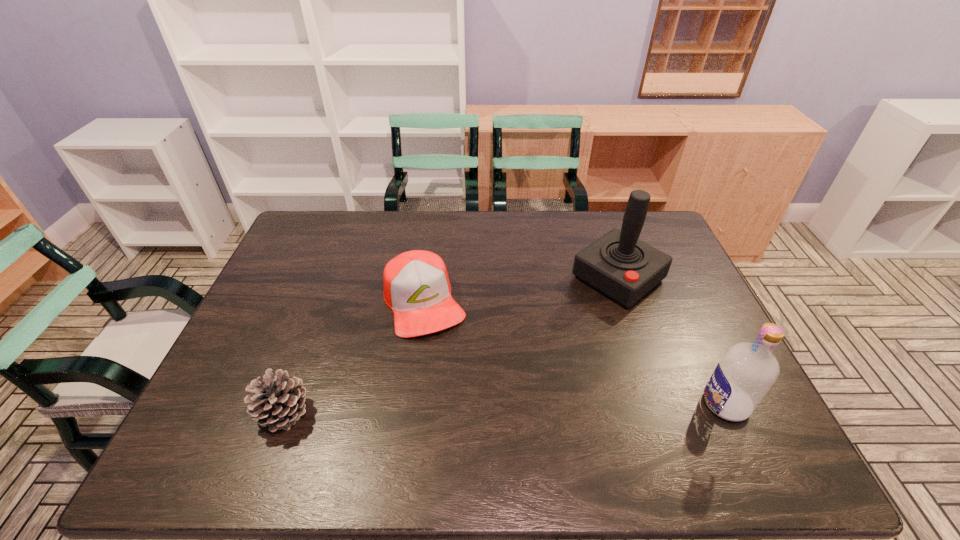
Image resolution: width=960 pixels, height=540 pixels. In order to click on vacant space located 0.060m on the front-facing side of the baseball cap in this screenshot , I will do `click(444, 354)`.

Locate an element on the screen. The height and width of the screenshot is (540, 960). free space located 0.280m on the base of the joystick is located at coordinates (524, 351).

At what (x,y) coordinates should I click in order to perform the action: click on vacant position located 0.290m on the base of the joystick. Please return your answer as a coordinate pair (x, y). This screenshot has width=960, height=540. Looking at the image, I should click on 521,353.

Identify the location of vacant space located 0.400m on the base of the joystick. This screenshot has width=960, height=540. pyautogui.click(x=492, y=376).

Locate an element on the screen. The width and height of the screenshot is (960, 540). object positioned at the far edge is located at coordinates (619, 265).

The height and width of the screenshot is (540, 960). I want to click on pinecone that is at the near edge, so click(x=279, y=401).

Identify the location of vodka at the near edge. This screenshot has height=540, width=960. (747, 371).

This screenshot has height=540, width=960. Find the location of `object at the left edge`. object at the left edge is located at coordinates (279, 401).

Find the location of a particular element. vodka present at the right edge is located at coordinates (747, 371).

Image resolution: width=960 pixels, height=540 pixels. I want to click on joystick present at the right edge, so click(x=619, y=265).